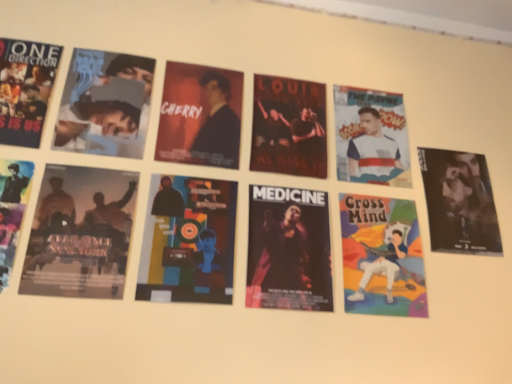
Question: Considering the relative sizes of matte black poster at left, which is the first poster in left-to-right order, and multicolored paper at center, positioned as the third poster in left-to-right order, in the image provided, is matte black poster at left, which is the first poster in left-to-right order, bigger than multicolored paper at center, positioned as the third poster in left-to-right order,?

Choices:
 (A) yes
 (B) no

Answer: (A)

Question: Does matte black poster at left, which is the 6th poster in right-to-left order, have a greater height compared to multicolored paper at center, the fourth poster when ordered from right to left?

Choices:
 (A) no
 (B) yes

Answer: (A)

Question: Is matte black poster at left, which is the first poster in left-to-right order, next to multicolored paper at center, positioned as the third poster in left-to-right order?

Choices:
 (A) no
 (B) yes

Answer: (A)

Question: Considering the relative positions of matte black poster at left, which is the 6th poster in right-to-left order, and multicolored paper at center, the fourth poster when ordered from right to left, in the image provided, is matte black poster at left, which is the 6th poster in right-to-left order, to the left of multicolored paper at center, the fourth poster when ordered from right to left, from the viewer's perspective?

Choices:
 (A) yes
 (B) no

Answer: (A)

Question: From a real-world perspective, is matte black poster at left, which is the 6th poster in right-to-left order, located beneath multicolored paper at center, positioned as the third poster in left-to-right order?

Choices:
 (A) no
 (B) yes

Answer: (B)

Question: In terms of height, does multicolored paper cross my mind poster at center right, the sixth poster positioned from the left, look taller or shorter compared to white fabric shirt at upper right, marked as the 3th person in a left-to-right arrangement?

Choices:
 (A) tall
 (B) short

Answer: (A)

Question: From a real-world perspective, is multicolored paper cross my mind poster at center right, the sixth poster positioned from the left, physically located above or below white fabric shirt at upper right, marked as the 3th person in a left-to-right arrangement?

Choices:
 (A) below
 (B) above

Answer: (A)

Question: Is point (360, 276) positioned closer to the camera than point (362, 129)?

Choices:
 (A) farther
 (B) closer

Answer: (B)

Question: Is multicolored paper cross my mind poster at center right, the sixth poster positioned from the left, situated inside white fabric shirt at upper right, acting as the second person starting from the right, or outside?

Choices:
 (A) inside
 (B) outside

Answer: (B)

Question: Is point (322, 152) positioned closer to the camera than point (317, 259)?

Choices:
 (A) farther
 (B) closer

Answer: (A)

Question: In terms of width, does dark matte poster at center, the 2th poster positioned from the right, look wider or thinner when compared to dark matte poster at center, arranged as the third poster when viewed from the right?

Choices:
 (A) thin
 (B) wide

Answer: (B)

Question: From a real-world perspective, relative to dark matte poster at center, positioned as the fourth poster in left-to-right order, is dark matte poster at center, the 5th poster in the left-to-right sequence, vertically above or below?

Choices:
 (A) above
 (B) below

Answer: (A)

Question: Relative to dark matte poster at center, arranged as the third poster when viewed from the right, is dark matte poster at center, the 5th poster in the left-to-right sequence, in front or behind?

Choices:
 (A) front
 (B) behind

Answer: (B)

Question: Looking at the image, does matte black jacket at center, the second person in the left-to-right sequence, seem bigger or smaller compared to silhouette paper poster at lower left, positioned as the 5th poster in right-to-left order?

Choices:
 (A) big
 (B) small

Answer: (B)

Question: In terms of width, does matte black jacket at center, the second person in the left-to-right sequence, look wider or thinner when compared to silhouette paper poster at lower left, positioned as the 5th poster in right-to-left order?

Choices:
 (A) thin
 (B) wide

Answer: (A)